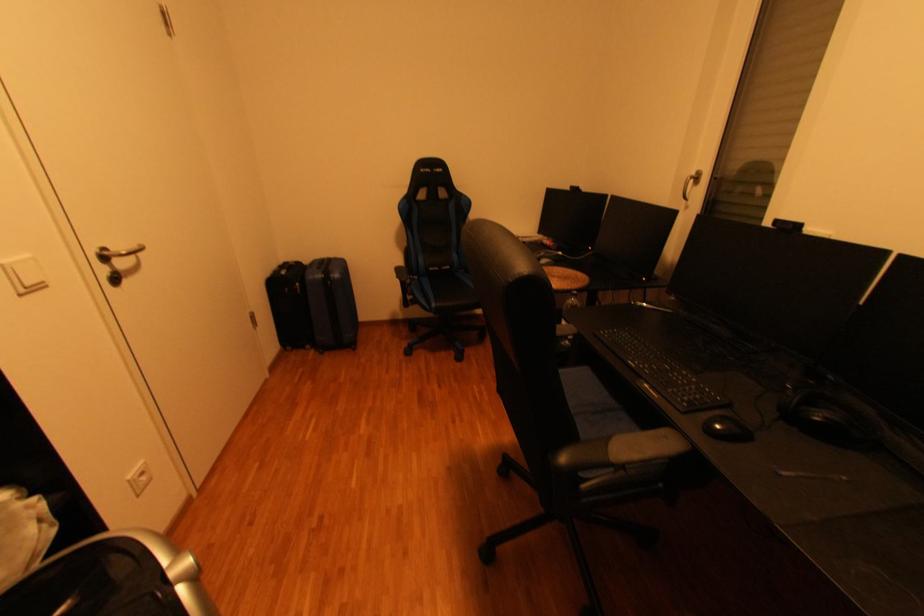
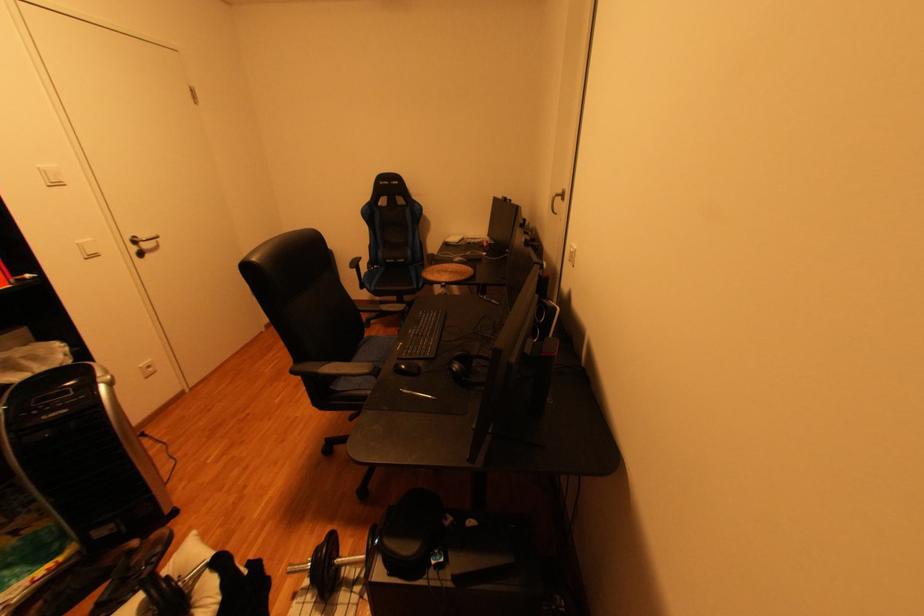
Locate, in the second image, the point that corresponds to point 426,278 in the first image.

(390, 267)